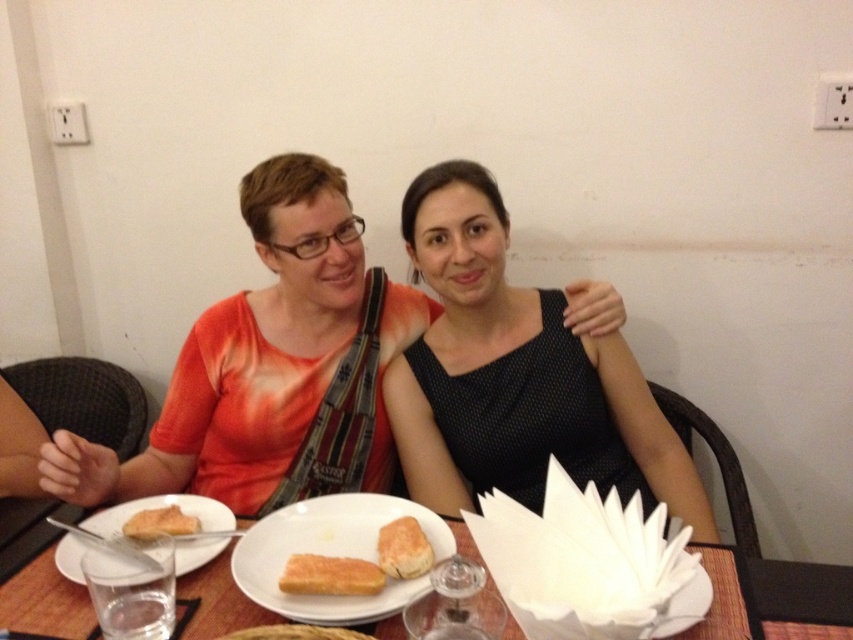
Can you confirm if white matte plate at lower left is wider than golden brown bread at lower left?

Indeed, white matte plate at lower left has a greater width compared to golden brown bread at lower left.

Find the location of a particular element. white matte plate at lower left is located at coordinates (177, 540).

Between white paper napkins at center and golden crispy toast at center, which one appears on the left side from the viewer's perspective?

golden crispy toast at center is more to the left.

Does white paper napkins at center lie in front of golden crispy toast at center?

Yes.

Which is in front, point (33, 625) or point (358, 595)?

Point (33, 625) is more forward.

Where is `white paper napkins at center`? white paper napkins at center is located at coordinates (772, 596).

Is golden crispy toast at center above golden brown crusty bread at center?

No.

Locate an element on the screen. golden crispy toast at center is located at coordinates (329, 576).